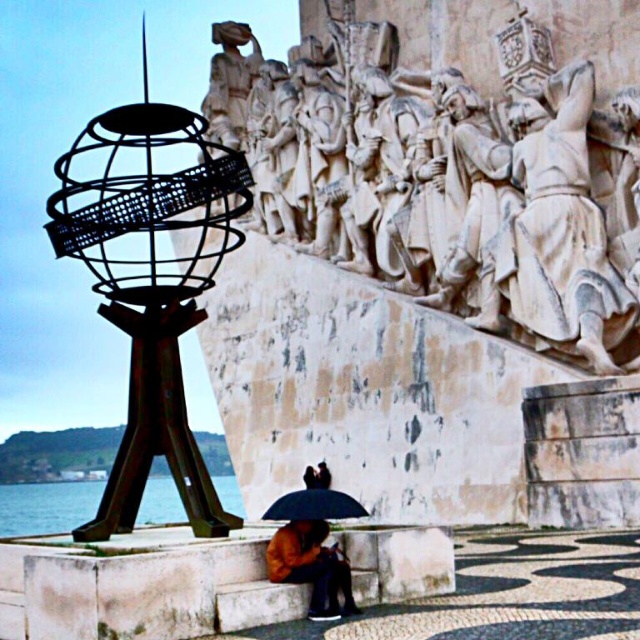
Question: Estimate the real-world distances between objects in this image. Which object is farther from the white stone carving at upper center?

Choices:
 (A) brown leather jacket at lower center
 (B) black matte umbrella at lower center
 (C) blue water at lower left

Answer: (C)

Question: Which of the following is the closest to the observer?

Choices:
 (A) (284, 516)
 (B) (54, 484)
 (C) (344, 588)
 (D) (588, 141)

Answer: (C)

Question: Which is nearer to the rustic metal globe at left?

Choices:
 (A) blue water at lower left
 (B) brown leather jacket at lower center
 (C) black matte umbrella at lower center

Answer: (B)

Question: Considering the relative positions of white stone carving at upper center and black matte umbrella at lower center in the image provided, where is white stone carving at upper center located with respect to black matte umbrella at lower center?

Choices:
 (A) above
 (B) below

Answer: (A)

Question: Does blue water at lower left have a smaller size compared to black matte umbrella at lower center?

Choices:
 (A) yes
 (B) no

Answer: (B)

Question: Can you confirm if blue water at lower left is bigger than brown leather jacket at lower center?

Choices:
 (A) no
 (B) yes

Answer: (B)